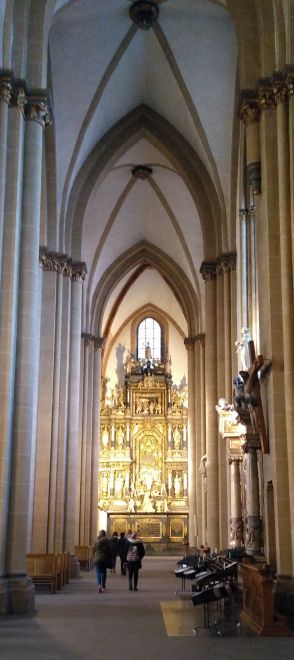
Identify the location of brown drawer. (254, 599).